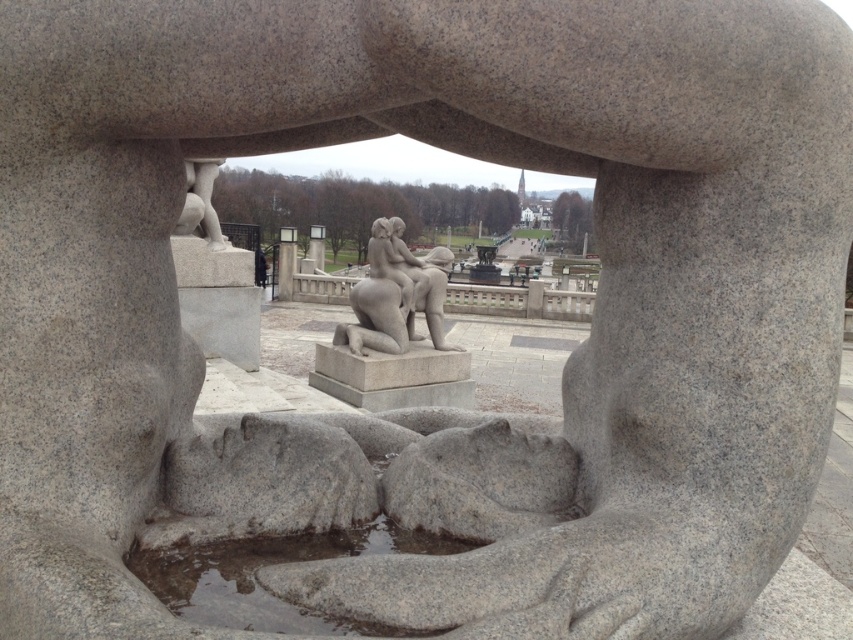
You are a maintenance worker needing to clean the transparent stone puddle at lower center. You have a mop that is 1 meter long. Can you reach the entire puddle without moving the mop?

The transparent stone puddle at lower center is 1.20 meters apart, so the mop which is 1 meter long is shorter than the required distance. Therefore, you cannot reach the entire puddle without moving the mop.

You are an architect examining the stone structure with the circular opening. You notice two points marked on the structure at coordinates point (340, 550) and point (376, 300). Which point is nearer to your viewpoint?

Point (340, 550) is closer to the camera than point (376, 300), so the point (340, 550) is nearer to your viewpoint.